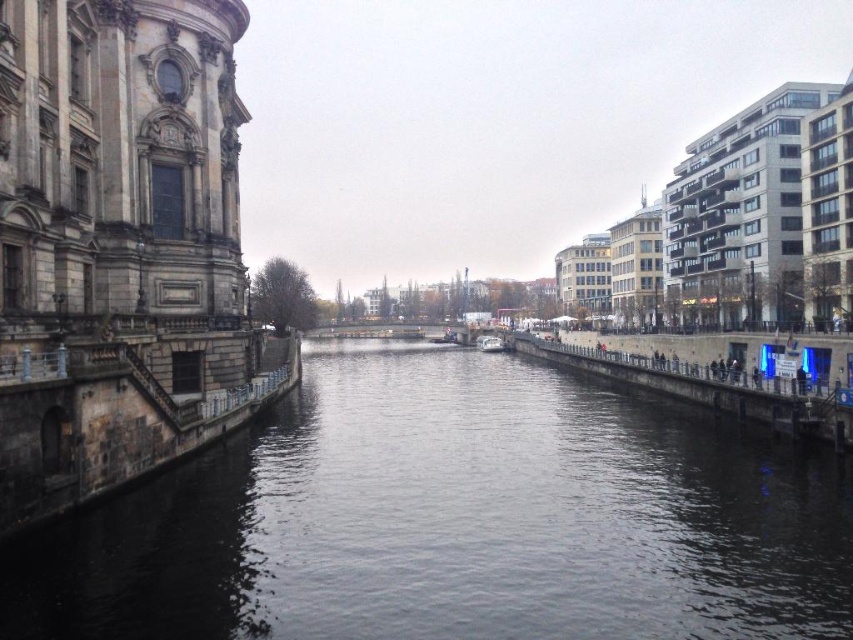
Question: Is dark water at center to the left of white plastic boat at center from the viewer's perspective?

Choices:
 (A) no
 (B) yes

Answer: (B)

Question: Is dark water at center bigger than white plastic boat at center?

Choices:
 (A) yes
 (B) no

Answer: (A)

Question: Which point is closer to the camera?

Choices:
 (A) click(x=695, y=637)
 (B) click(x=482, y=349)

Answer: (A)

Question: Is dark water at center positioned at the back of white plastic boat at center?

Choices:
 (A) yes
 (B) no

Answer: (B)